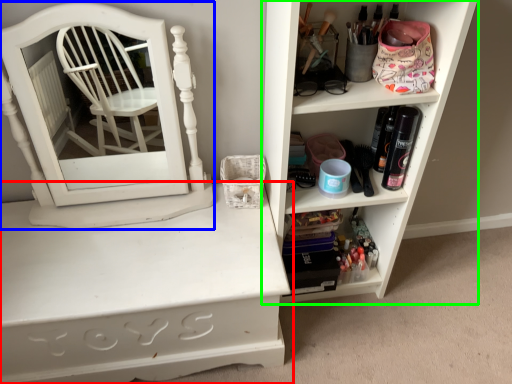
Question: Which object is the closest to the shelf (highlighted by a red box)? Choose among these: medicine cabinet (highlighted by a blue box) or shelf (highlighted by a green box).

Choices:
 (A) medicine cabinet
 (B) shelf

Answer: (A)